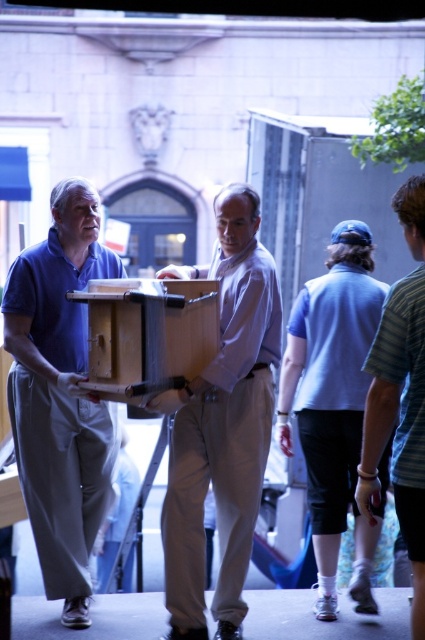
The height and width of the screenshot is (640, 425). What do you see at coordinates (401, 397) in the screenshot? I see `striped cotton shirt at right` at bounding box center [401, 397].

Who is more distant from viewer, (x=365, y=492) or (x=139, y=387)?

Positioned behind is point (x=365, y=492).

Is point (418, 320) farther from camera compared to point (153, 339)?

No, it is in front of (153, 339).

Locate an element on the screen. Image resolution: width=425 pixels, height=640 pixels. striped cotton shirt at right is located at coordinates (401, 397).

Is the position of matte wood box at left more distant than that of striped cotton shirt at right?

Yes, it is.

This screenshot has width=425, height=640. Identify the location of matte wood box at left. (59, 394).

This screenshot has height=640, width=425. I want to click on matte wood box at left, so click(x=59, y=394).

Can you confirm if light blue shirt at center is positioned to the left of striped cotton shirt at right?

Correct, you'll find light blue shirt at center to the left of striped cotton shirt at right.

Based on the photo, does light blue shirt at center have a larger size compared to striped cotton shirt at right?

Incorrect, light blue shirt at center is not larger than striped cotton shirt at right.

At what (x,y) coordinates should I click in order to perform the action: click on light blue shirt at center. Please return your answer as a coordinate pair (x, y). This screenshot has height=640, width=425. Looking at the image, I should click on (334, 404).

The height and width of the screenshot is (640, 425). I want to click on light blue shirt at center, so click(x=334, y=404).